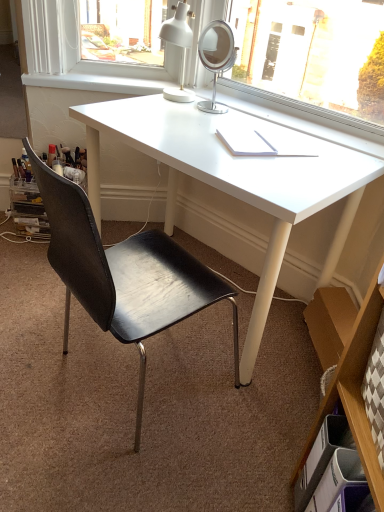
Question: Is black leather chair at center at the right side of white plastic drawer at lower right?

Choices:
 (A) no
 (B) yes

Answer: (A)

Question: From a real-world perspective, is black leather chair at center physically below white plastic drawer at lower right?

Choices:
 (A) yes
 (B) no

Answer: (B)

Question: Would you say black leather chair at center is a long distance from white plastic drawer at lower right?

Choices:
 (A) yes
 (B) no

Answer: (B)

Question: Considering the relative positions of black leather chair at center and white plastic drawer at lower right in the image provided, is black leather chair at center to the left of white plastic drawer at lower right from the viewer's perspective?

Choices:
 (A) yes
 (B) no

Answer: (A)

Question: Is black leather chair at center further to camera compared to white plastic drawer at lower right?

Choices:
 (A) yes
 (B) no

Answer: (B)

Question: Can you confirm if black leather chair at center is shorter than white plastic drawer at lower right?

Choices:
 (A) yes
 (B) no

Answer: (B)

Question: Could you tell me if white smooth window sill at upper center is turned towards white plastic drawer at lower right?

Choices:
 (A) yes
 (B) no

Answer: (B)

Question: Does white smooth window sill at upper center contain white plastic drawer at lower right?

Choices:
 (A) no
 (B) yes

Answer: (A)

Question: Considering the relative positions of white smooth window sill at upper center and white plastic drawer at lower right in the image provided, is white smooth window sill at upper center to the right of white plastic drawer at lower right from the viewer's perspective?

Choices:
 (A) no
 (B) yes

Answer: (A)

Question: Does white smooth window sill at upper center have a lesser height compared to white plastic drawer at lower right?

Choices:
 (A) yes
 (B) no

Answer: (A)

Question: Would you consider white smooth window sill at upper center to be distant from white plastic drawer at lower right?

Choices:
 (A) yes
 (B) no

Answer: (A)

Question: From a real-world perspective, does white smooth window sill at upper center sit lower than white plastic drawer at lower right?

Choices:
 (A) yes
 (B) no

Answer: (B)

Question: From the image's perspective, does white glossy desk at center appear lower than black leather chair at center?

Choices:
 (A) yes
 (B) no

Answer: (B)